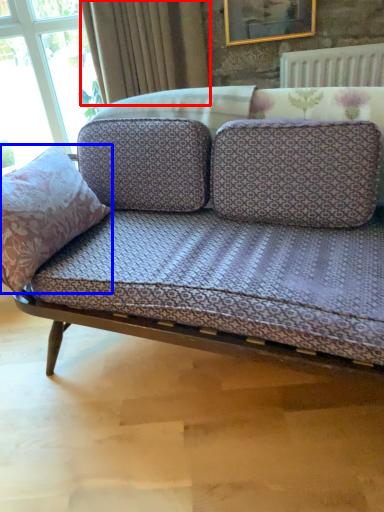
Question: Which object appears closest to the camera in this image, curtain (highlighted by a red box) or throw pillow (highlighted by a blue box)?

Choices:
 (A) curtain
 (B) throw pillow

Answer: (B)